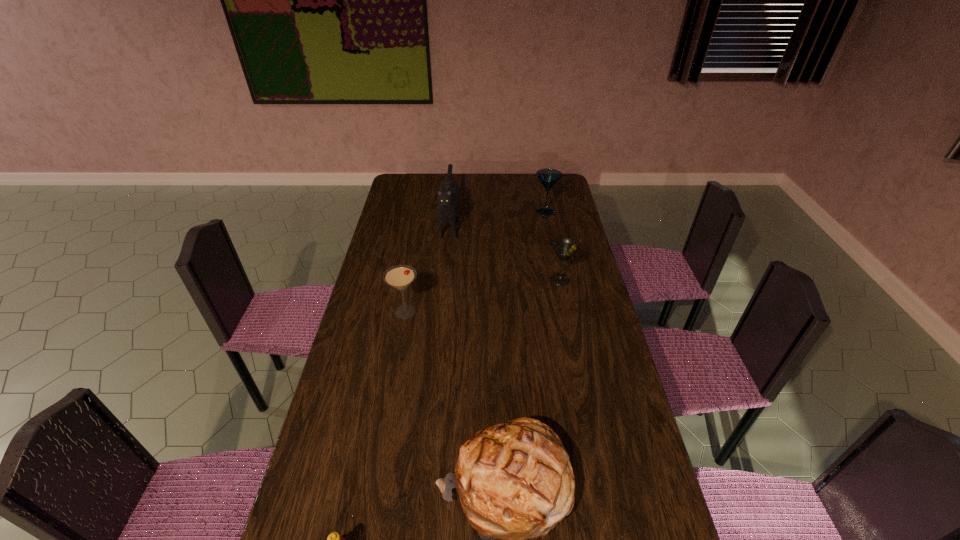
Identify the location of cat. The height and width of the screenshot is (540, 960). (447, 210).

Identify the location of the farthest martini. The width and height of the screenshot is (960, 540). (548, 177).

Locate an element on the screen. the second nearest martini is located at coordinates (564, 248).

Find the location of a particular element. The height and width of the screenshot is (540, 960). the nearest martini is located at coordinates (399, 277).

Locate an element on the screen. The image size is (960, 540). the fourth farthest object is located at coordinates (399, 277).

Locate an element on the screen. vacant region located 0.220m on the front-facing side of the tallest object is located at coordinates (444, 282).

Where is `vacant point located on the left of the farthest martini`? vacant point located on the left of the farthest martini is located at coordinates (465, 212).

At what (x,y) coordinates should I click in order to perform the action: click on vacant space located on the left of the fourth nearest object. Please return your answer as a coordinate pair (x, y). The height and width of the screenshot is (540, 960). Looking at the image, I should click on (490, 280).

Image resolution: width=960 pixels, height=540 pixels. Identify the location of vacant position located on the back of the third nearest object. point(419,238).

Where is `object that is positioned at the far edge`? object that is positioned at the far edge is located at coordinates (447, 210).